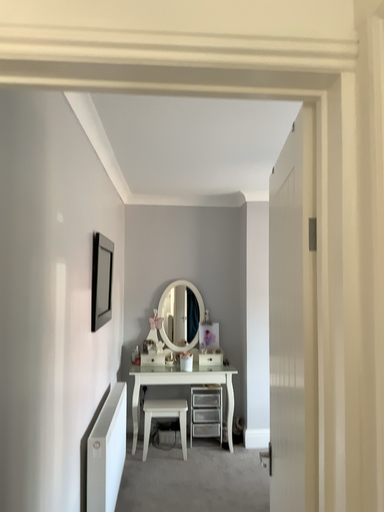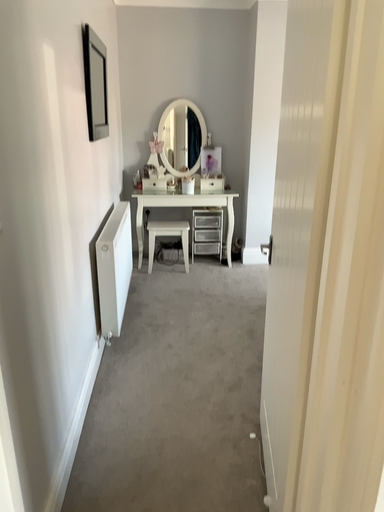
Question: Which way did the camera rotate in the video?

Choices:
 (A) rotated downward
 (B) rotated upward

Answer: (A)